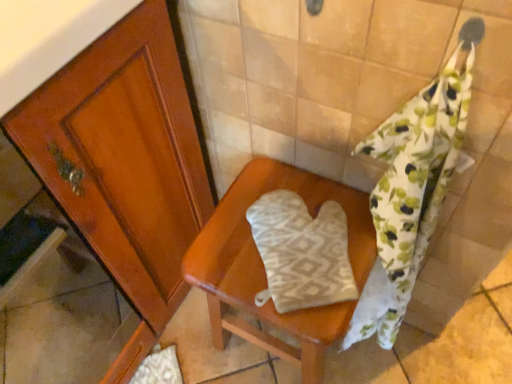
In order to face floral cotton towel at right, should I rotate leftwards or rightwards?

A 16.365 degree turn to the right will do.

Locate an element on the screen. The height and width of the screenshot is (384, 512). beige fabric oven mitt at center is located at coordinates pyautogui.click(x=264, y=269).

At what (x,y) coordinates should I click in order to perform the action: click on white textured oven mitt at center. Please return your answer as a coordinate pair (x, y). Looking at the image, I should click on (301, 252).

From the image's perspective, does beige fabric oven mitt at center appear lower than white textured oven mitt at center?

Yes, from the image's perspective, beige fabric oven mitt at center is beneath white textured oven mitt at center.

Is beige fabric oven mitt at center oriented towards white textured oven mitt at center?

No.

Are beige fabric oven mitt at center and white textured oven mitt at center making contact?

Indeed, beige fabric oven mitt at center and white textured oven mitt at center are beside each other and touching.

In terms of width, does beige fabric oven mitt at center look wider or thinner when compared to white textured oven mitt at center?

beige fabric oven mitt at center is wider than white textured oven mitt at center.

In the scene shown: From the image's perspective, between white textured oven mitt at center and beige fabric oven mitt at center, which one is located above?

white textured oven mitt at center appears higher in the image.

Is white textured oven mitt at center looking in the opposite direction of beige fabric oven mitt at center?

No.

Considering the positions of points (248, 219) and (258, 272), is point (248, 219) farther from camera compared to point (258, 272)?

Yes.

Would you say beige fabric oven mitt at center is part of white textured oven mitt at center's contents?

No, beige fabric oven mitt at center is not a part of white textured oven mitt at center.

Considering the sizes of objects beige fabric oven mitt at center and floral cotton towel at right in the image provided, who is wider, beige fabric oven mitt at center or floral cotton towel at right?

Wider between the two is beige fabric oven mitt at center.

Between beige fabric oven mitt at center and floral cotton towel at right, which one is positioned in front?

floral cotton towel at right.

Is beige fabric oven mitt at center positioned far away from floral cotton towel at right?

No, beige fabric oven mitt at center is not far away from floral cotton towel at right.

Does floral cotton towel at right have a larger size compared to white textured oven mitt at center?

Yes, floral cotton towel at right is bigger than white textured oven mitt at center.

Is floral cotton towel at right directly adjacent to white textured oven mitt at center?

No, floral cotton towel at right is not beside white textured oven mitt at center.

How different are the orientations of floral cotton towel at right and white textured oven mitt at center in degrees?

The angular difference between floral cotton towel at right and white textured oven mitt at center is 42.2 degrees.

Considering the relative sizes of floral cotton towel at right and white textured oven mitt at center in the image provided, is floral cotton towel at right thinner than white textured oven mitt at center?

A: Yes.

From a real-world perspective, between floral cotton towel at right and beige fabric oven mitt at center, who is vertically lower?

From a 3D spatial view, beige fabric oven mitt at center is below.

From the image's perspective, is floral cotton towel at right located above or below beige fabric oven mitt at center?

Based on their image positions, floral cotton towel at right is located above beige fabric oven mitt at center.

In order to click on furniture directly beneath the floral cotton towel at right (from a real-world perspective) in this screenshot , I will do `click(264, 269)`.

Looking at this image, how different are the orientations of floral cotton towel at right and beige fabric oven mitt at center in degrees?

The angular difference between floral cotton towel at right and beige fabric oven mitt at center is 0.000488 degrees.

Can you confirm if white textured oven mitt at center is wider than floral cotton towel at right?

Yes.

Is white textured oven mitt at center facing towards floral cotton towel at right?

Yes, white textured oven mitt at center is turned towards floral cotton towel at right.

Find the location of `furniture that appears on the left of white textured oven mitt at center`. furniture that appears on the left of white textured oven mitt at center is located at coordinates (264, 269).

I want to click on throw pillow on the right of beige fabric oven mitt at center, so click(x=301, y=252).

From the image, which object appears to be farther from floral cotton towel at right, beige fabric oven mitt at center or white textured oven mitt at center?

The object further to floral cotton towel at right is beige fabric oven mitt at center.

From the picture: When comparing their distances from white textured oven mitt at center, does floral cotton towel at right or beige fabric oven mitt at center seem further?

Among the two, floral cotton towel at right is located further to white textured oven mitt at center.

In the scene shown: Based on their spatial positions, is white textured oven mitt at center or beige fabric oven mitt at center further from floral cotton towel at right?

Based on the image, beige fabric oven mitt at center appears to be further to floral cotton towel at right.

Estimate the real-world distances between objects in this image. Which object is closer to white textured oven mitt at center, beige fabric oven mitt at center or floral cotton towel at right?

Answer: beige fabric oven mitt at center is positioned closer to the anchor white textured oven mitt at center.

Which object lies nearer to the anchor point beige fabric oven mitt at center, floral cotton towel at right or white textured oven mitt at center?

white textured oven mitt at center is positioned closer to the anchor beige fabric oven mitt at center.

From the image, which object appears to be farther from beige fabric oven mitt at center, white textured oven mitt at center or floral cotton towel at right?

Among the two, floral cotton towel at right is located further to beige fabric oven mitt at center.

Image resolution: width=512 pixels, height=384 pixels. In order to click on furniture between floral cotton towel at right and white textured oven mitt at center in the front-back direction in this screenshot , I will do `click(264, 269)`.